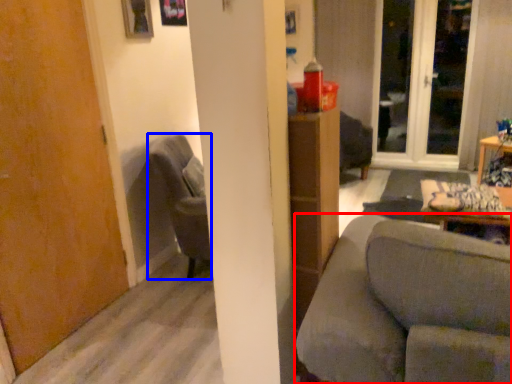
Question: Which point is closer to the camera, studio couch (highlighted by a red box) or chair (highlighted by a blue box)?

Choices:
 (A) studio couch
 (B) chair

Answer: (A)